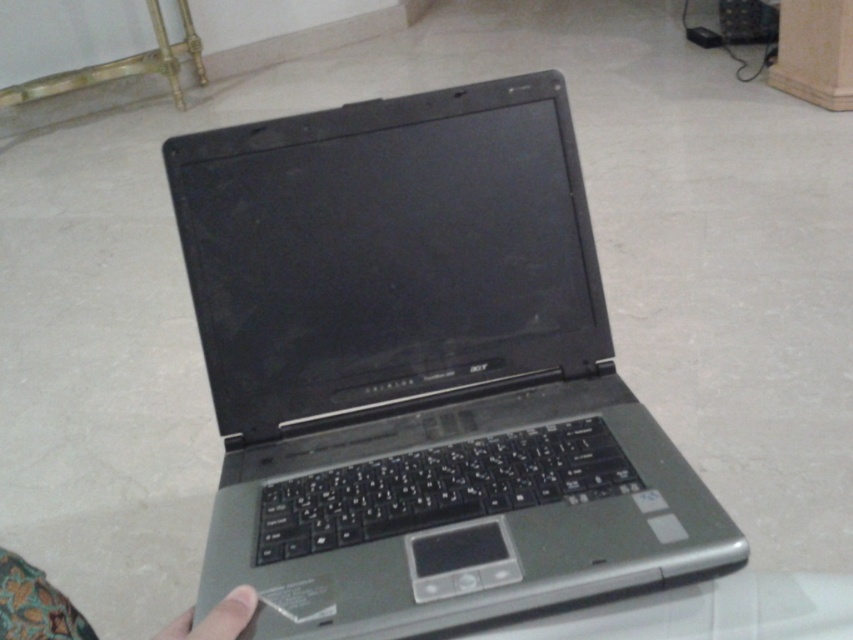
Question: Which of these objects is positioned farthest from the skinny finger at lower left?

Choices:
 (A) skin/soft/hand at lower center
 (B) satin silver laptop at center

Answer: (B)

Question: Does satin silver laptop at center have a greater width compared to skinny finger at lower left?

Choices:
 (A) yes
 (B) no

Answer: (A)

Question: Which object is the farthest from the skin/soft/hand at lower center?

Choices:
 (A) satin silver laptop at center
 (B) skinny finger at lower left

Answer: (A)

Question: Which object is the closest to the satin silver laptop at center?

Choices:
 (A) skinny finger at lower left
 (B) skin/soft/hand at lower center

Answer: (A)

Question: Where is satin silver laptop at center located in relation to skin/soft/hand at lower center in the image?

Choices:
 (A) left
 (B) right

Answer: (B)

Question: Does satin silver laptop at center appear over skin/soft/hand at lower center?

Choices:
 (A) yes
 (B) no

Answer: (A)